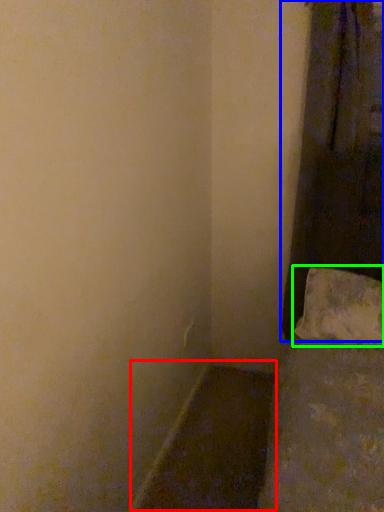
Question: Which object is the closest to the window sill (highlighted by a red box)? Choose among these: curtain (highlighted by a blue box) or pillow (highlighted by a green box).

Choices:
 (A) curtain
 (B) pillow

Answer: (B)